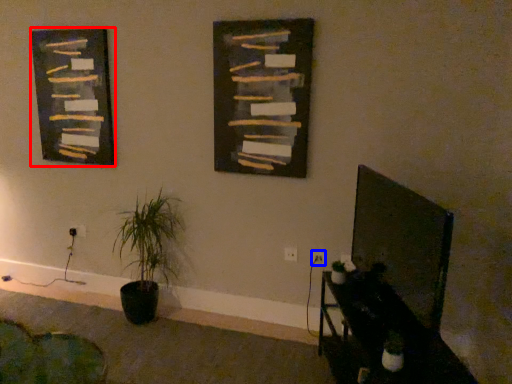
Question: Which of the following is the farthest to the observer, picture frame (highlighted by a red box) or electric outlet (highlighted by a blue box)?

Choices:
 (A) picture frame
 (B) electric outlet

Answer: (A)